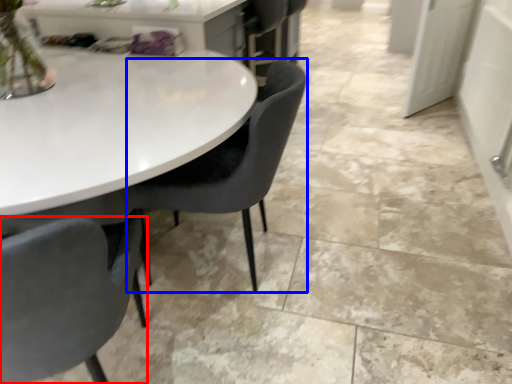
Question: Among these objects, which one is farthest to the camera, chair (highlighted by a red box) or chair (highlighted by a blue box)?

Choices:
 (A) chair
 (B) chair

Answer: (B)